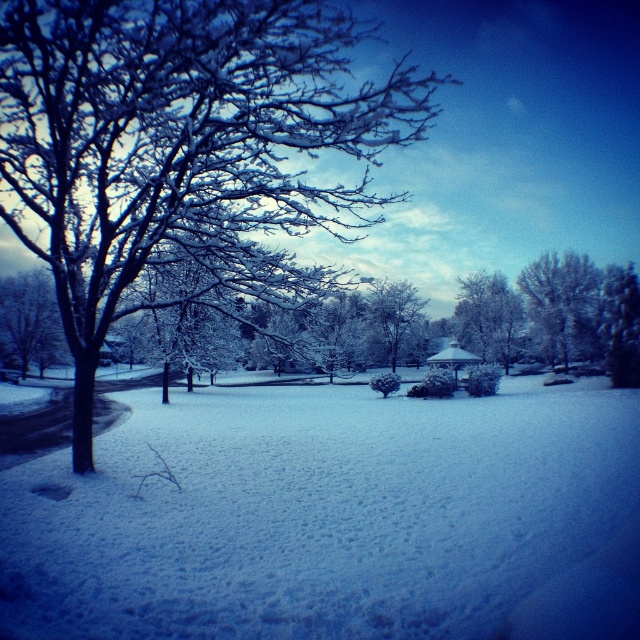
Question: Which object is closer to the camera taking this photo?

Choices:
 (A) snow-covered branches at left
 (B) white fluffy snow at center
 (C) snowy bark tree at center
 (D) white frosty tree at center

Answer: (B)

Question: Does white fluffy snow at center appear under snow-covered branches at left?

Choices:
 (A) yes
 (B) no

Answer: (A)

Question: In this image, where is white frosty tree at upper right located relative to white frosty tree at center?

Choices:
 (A) right
 (B) left

Answer: (A)

Question: Which is nearer to the green textured bush at right?

Choices:
 (A) white frosty tree at upper right
 (B) white frosty tree at center

Answer: (A)

Question: Which object is farther from the camera taking this photo?

Choices:
 (A) white fluffy snow at center
 (B) snowy bark tree at center
 (C) white frosty tree at upper right
 (D) snow-covered branches at left

Answer: (B)

Question: Can you confirm if snow-covered branches at left is wider than snowy bark tree at center?

Choices:
 (A) yes
 (B) no

Answer: (A)